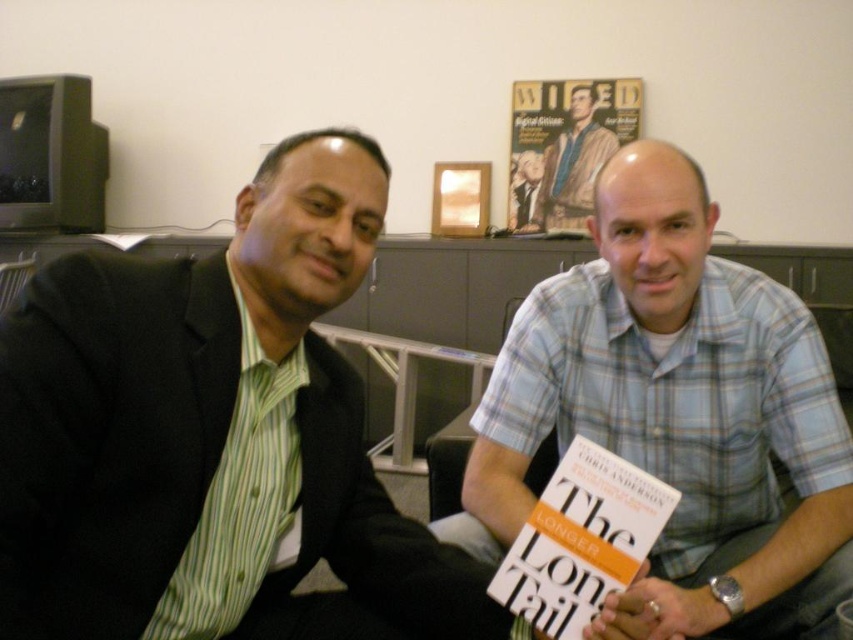
Question: Which object is the farthest from the blue plaid shirt at center?

Choices:
 (A) white paper book at center
 (B) matte black suit at left

Answer: (B)

Question: Considering the relative positions of matte black suit at left and blue plaid shirt at center in the image provided, where is matte black suit at left located with respect to blue plaid shirt at center?

Choices:
 (A) left
 (B) right

Answer: (A)

Question: Considering the real-world distances, which object is farthest from the matte black suit at left?

Choices:
 (A) blue plaid shirt at center
 (B) white paper book at center

Answer: (A)

Question: Which point is farther from the camera taking this photo?

Choices:
 (A) (735, 493)
 (B) (590, 83)

Answer: (B)

Question: Does matte black suit at left appear over white paper book at center?

Choices:
 (A) no
 (B) yes

Answer: (B)

Question: Observing the image, what is the correct spatial positioning of white paper book at center in reference to blue plaid shirt at center?

Choices:
 (A) right
 (B) left

Answer: (B)